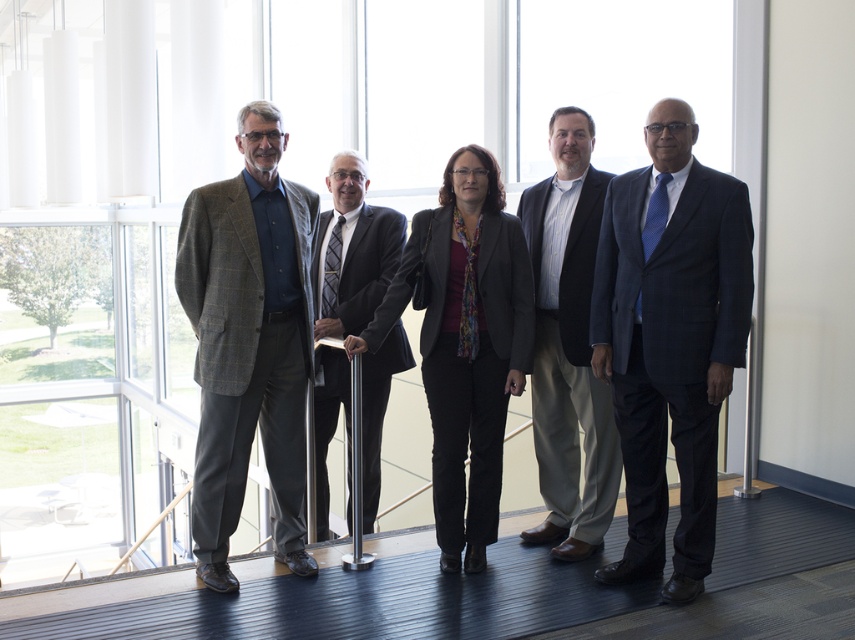
Does matte black blazer at center appear over dark gray wool suit at center?

Correct, matte black blazer at center is located above dark gray wool suit at center.

Which of these two, matte black blazer at center or dark gray wool suit at center, stands taller?

With more height is dark gray wool suit at center.

Which is in front, point (476, 465) or point (404, 240)?

Point (476, 465) is more forward.

Image resolution: width=855 pixels, height=640 pixels. What are the coordinates of `matte black blazer at center` in the screenshot? It's located at tap(466, 362).

Does plaid wool blazer at left appear on the left side of matte gray suit at center?

Yes, plaid wool blazer at left is to the left of matte gray suit at center.

Describe the element at coordinates (249, 342) in the screenshot. I see `plaid wool blazer at left` at that location.

At what (x,y) coordinates should I click in order to perform the action: click on plaid wool blazer at left. Please return your answer as a coordinate pair (x, y). The height and width of the screenshot is (640, 855). Looking at the image, I should click on (249, 342).

Can you confirm if matte gray suit at center is positioned to the left of light brown suit at center?

Correct, you'll find matte gray suit at center to the left of light brown suit at center.

Who is shorter, matte gray suit at center or light brown suit at center?

With less height is light brown suit at center.

Does point (681, 496) come in front of point (594, 490)?

That is True.

The image size is (855, 640). Find the location of `matte gray suit at center`. matte gray suit at center is located at coordinates (444, 435).